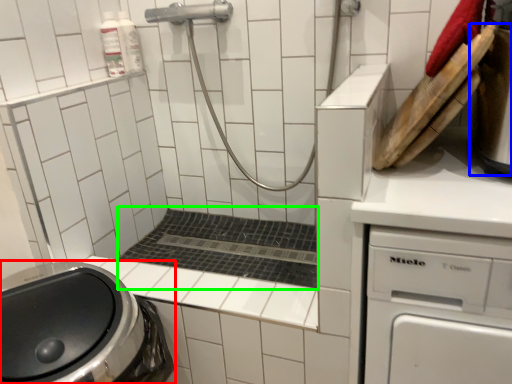
Question: Which object is the farthest from washing machine (highlighted by a red box)? Choose among these: appliance (highlighted by a blue box) or bath (highlighted by a green box).

Choices:
 (A) appliance
 (B) bath

Answer: (A)